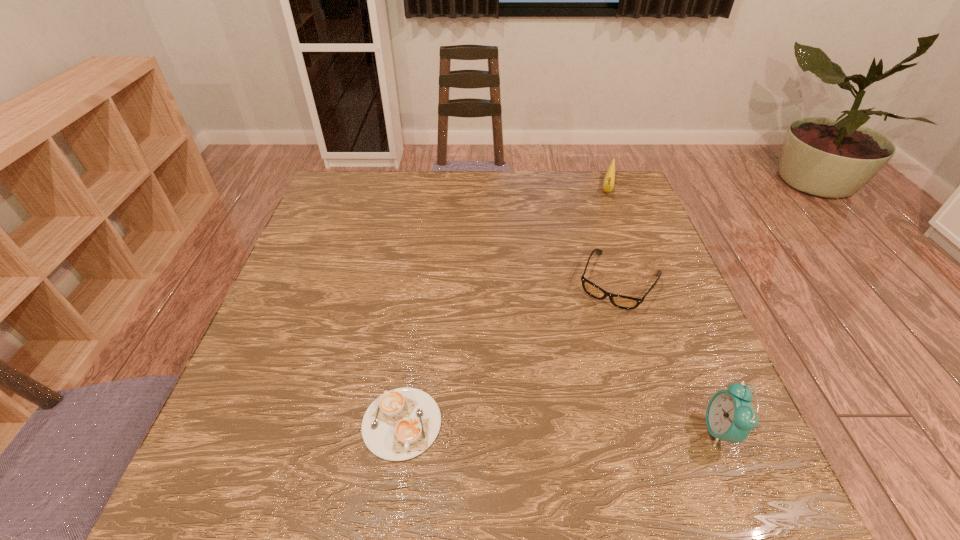
The width and height of the screenshot is (960, 540). Identify the location of the leftmost object. (402, 423).

Identify the location of cappuccino. Image resolution: width=960 pixels, height=540 pixels. (402, 423).

Find the location of a particular element. The image size is (960, 540). alarm clock is located at coordinates (730, 417).

At what (x,y) coordinates should I click in order to perform the action: click on the second shortest object. Please return your answer as a coordinate pair (x, y). Looking at the image, I should click on (623, 302).

Where is `spectacles`? spectacles is located at coordinates (623, 302).

Locate an element on the screen. The width and height of the screenshot is (960, 540). the farthest object is located at coordinates (609, 180).

The image size is (960, 540). I want to click on banana, so click(609, 180).

What are the coordinates of `blank area located 0.160m on the right of the shortest object` in the screenshot? It's located at (528, 423).

Locate an element on the screen. The image size is (960, 540). vacant space located 0.160m on the face of the tallest object is located at coordinates (615, 430).

Locate an element on the screen. Image resolution: width=960 pixels, height=540 pixels. free region located on the face of the tallest object is located at coordinates (561, 430).